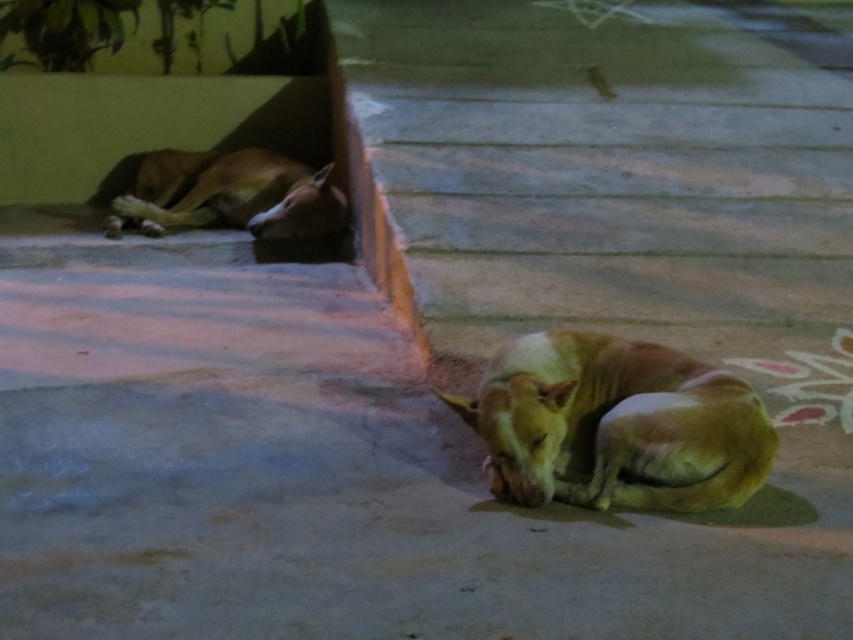
You are a dog owner who wants to take a photo of both the golden fur dog at lower right and the brown furry dog at upper left. Based on their positions, which dog is more to the right in the image?

The golden fur dog at lower right is positioned on the right side of brown furry dog at upper left, so the golden fur dog at lower right is more to the right.

You are a photographer setting up a tripod to take a nighttime photo of the gray concrete pavement at center and the brown furry dog at upper left. Based on their positions, which object should you focus on first to ensure both are in frame?

The gray concrete pavement at center is located below the brown furry dog at upper left, so you should focus on the brown furry dog at upper left first to ensure both are in frame.